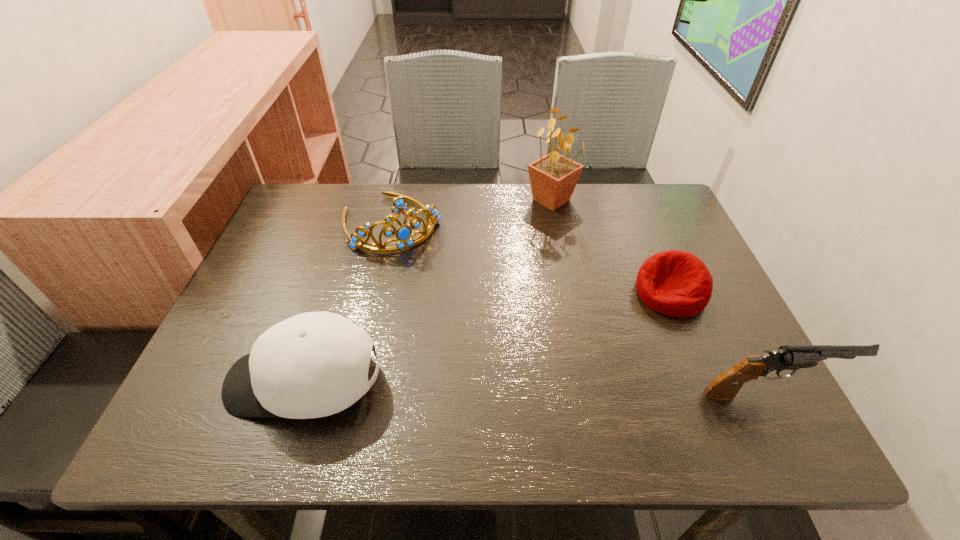
Where is `baseball cap`? baseball cap is located at coordinates pyautogui.click(x=315, y=364).

Find the location of a particular element. The height and width of the screenshot is (540, 960). gun is located at coordinates (725, 386).

Locate an element on the screen. The width and height of the screenshot is (960, 540). beanbag is located at coordinates (676, 283).

Image resolution: width=960 pixels, height=540 pixels. Identify the location of the shortest object. 676,283.

You are a GUI agent. You are given a task and a screenshot of the screen. Output one action in this format:
    pyautogui.click(x=<x>, y=<y>)
    Task: Click on the third object from right to left
    The image size is (960, 540).
    Given the screenshot: What is the action you would take?
    pyautogui.click(x=553, y=178)

This screenshot has width=960, height=540. I want to click on sunflower, so click(553, 178).

You are a GUI agent. You are given a task and a screenshot of the screen. Output one action in this format:
    pyautogui.click(x=<x>, y=<y>)
    Task: Click on the tiara
    The height and width of the screenshot is (540, 960).
    Given the screenshot: What is the action you would take?
    pyautogui.click(x=403, y=234)

Image resolution: width=960 pixels, height=540 pixels. What are the coordinates of `free space located on the seat area of the beanbag` in the screenshot? It's located at (578, 394).

You are a GUI agent. You are given a task and a screenshot of the screen. Output one action in this format:
    pyautogui.click(x=<x>, y=<y>)
    Task: Click on the free location located on the seat area of the beanbag
    
    Given the screenshot: What is the action you would take?
    pyautogui.click(x=636, y=329)

Where is `vacant space located 0.170m on the seat area of the beanbag`? vacant space located 0.170m on the seat area of the beanbag is located at coordinates (612, 356).